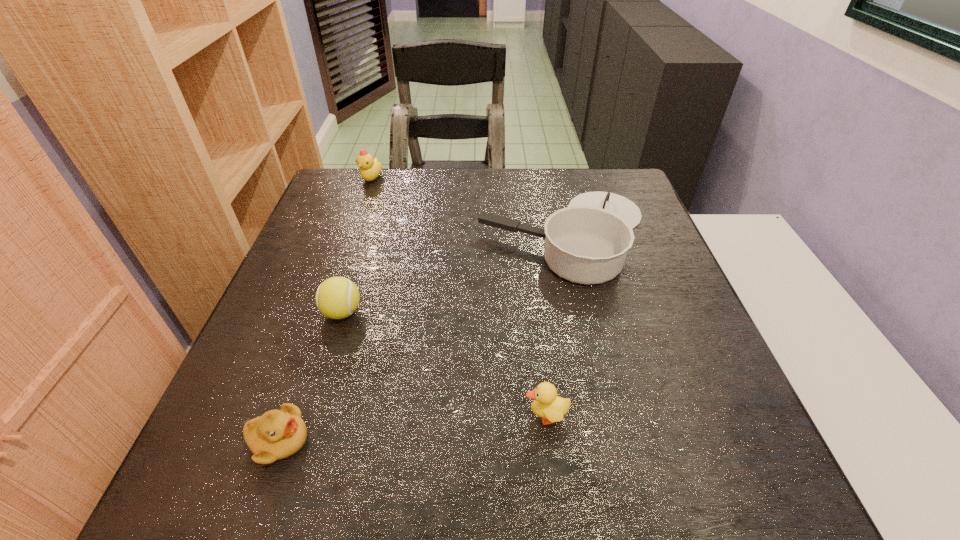
This screenshot has width=960, height=540. What are the coordinates of `vacant space at the left edge` in the screenshot? It's located at (331, 224).

You are a GUI agent. You are given a task and a screenshot of the screen. Output one action in this format:
    pyautogui.click(x=<x>, y=<y>)
    Task: Click on the free space at the right edge of the desktop
    
    Given the screenshot: What is the action you would take?
    pyautogui.click(x=668, y=255)

I want to click on free space at the near left corner of the desktop, so click(x=192, y=471).

The width and height of the screenshot is (960, 540). Identify the location of blank space at the near right corner of the desktop. (685, 472).

Locate an element on the screen. The image size is (960, 540). free spot between the tennis ball and the farthest duckling is located at coordinates (357, 246).

Identify the location of vacant area between the fourth nearest object and the farthest object. The width and height of the screenshot is (960, 540). (468, 207).

This screenshot has height=540, width=960. What are the coordinates of `unoccupied area between the fourth nearest object and the third farthest object` in the screenshot? It's located at (453, 273).

Locate which object ranks in proximity to the rightmost duckling. Please provide its 2D coordinates. Your answer should be formatted as a tuple, i.e. [(x, y)], where the tuple contains the x and y coordinates of a point satisfying the conditions above.

[(587, 242)]

Locate which object is the second closest to the third farthest object. Please provide its 2D coordinates. Your answer should be formatted as a tuple, i.e. [(x, y)], where the tuple contains the x and y coordinates of a point satisfying the conditions above.

[(587, 242)]

Locate an element on the screen. the closest duckling to the saucepan is located at coordinates (x=551, y=408).